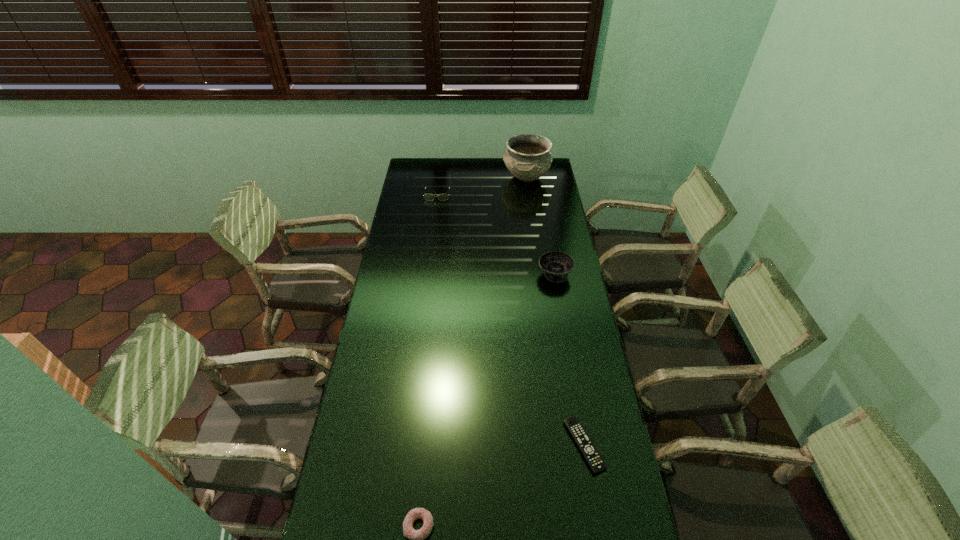
You are a GUI agent. You are given a task and a screenshot of the screen. Output one action in this format:
    pyautogui.click(x=<x>, y=<y>)
    Task: Click on the free space that is in between the pottery and the fourth farthest object
    
    Given the screenshot: What is the action you would take?
    pyautogui.click(x=555, y=311)

Find the location of a particular element. The height and width of the screenshot is (540, 960). vacant area that lies between the second nearest object and the third farthest object is located at coordinates (569, 360).

Identify the location of free spot between the shortest object and the tallest object. (555, 311).

Identify the location of vacant point located between the shortest object and the second tallest object. (569, 360).

Point out which object is positioned as the fourth nearest to the spectacles. Please provide its 2D coordinates. Your answer should be formatted as a tuple, i.e. [(x, y)], where the tuple contains the x and y coordinates of a point satisfying the conditions above.

[(416, 538)]

The image size is (960, 540). I want to click on object that is the closest to the tallest object, so click(x=429, y=197).

At what (x,y) coordinates should I click in order to perform the action: click on free point that satisfies the following two spatial constraints: 1. on the front-facing side of the spectacles; 2. on the right side of the third nearest object. Please return your answer as a coordinate pair (x, y). This screenshot has height=540, width=960. Looking at the image, I should click on pyautogui.click(x=427, y=274).

Locate an element on the screen. The width and height of the screenshot is (960, 540). free region that satisfies the following two spatial constraints: 1. on the front-facing side of the third nearest object; 2. on the right side of the third shortest object is located at coordinates (427, 274).

You are a GUI agent. You are given a task and a screenshot of the screen. Output one action in this format:
    pyautogui.click(x=<x>, y=<y>)
    Task: Click on the vacant point that satisfies the following two spatial constraints: 1. on the front side of the third nearest object; 2. on the right side of the pottery
    The image size is (960, 540).
    Given the screenshot: What is the action you would take?
    pyautogui.click(x=540, y=274)